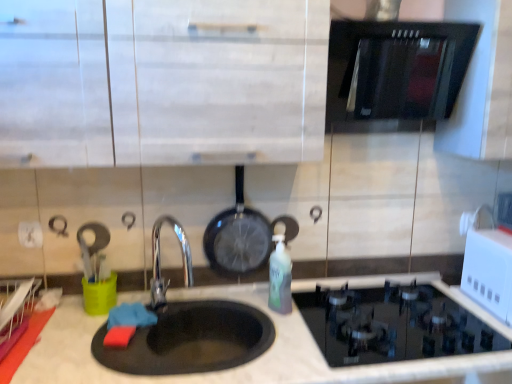
Identify the location of vacant space to the left of translucent green bottle at center. (241, 307).